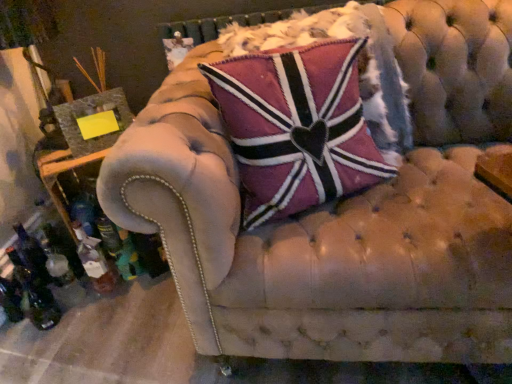
Question: Is translucent glass bottle at lower left to the left or to the right of pink velvet pillow at center in the image?

Choices:
 (A) left
 (B) right

Answer: (A)

Question: From their relative heights in the image, would you say translucent glass bottle at lower left is taller or shorter than pink velvet pillow at center?

Choices:
 (A) short
 (B) tall

Answer: (A)

Question: Considering their positions, is translucent glass bottle at lower left located in front of or behind pink velvet pillow at center?

Choices:
 (A) front
 (B) behind

Answer: (B)

Question: Relative to translucent glass bottle at lower left, is pink velvet pillow at center in front or behind?

Choices:
 (A) behind
 (B) front

Answer: (B)

Question: Is pink velvet pillow at center inside or outside of translucent glass bottle at lower left?

Choices:
 (A) outside
 (B) inside

Answer: (A)

Question: Considering the positions of pink velvet pillow at center and translucent glass bottle at lower left in the image, is pink velvet pillow at center bigger or smaller than translucent glass bottle at lower left?

Choices:
 (A) small
 (B) big

Answer: (B)

Question: Considering the positions of point (261, 59) and point (79, 236), is point (261, 59) closer or farther from the camera than point (79, 236)?

Choices:
 (A) closer
 (B) farther

Answer: (A)